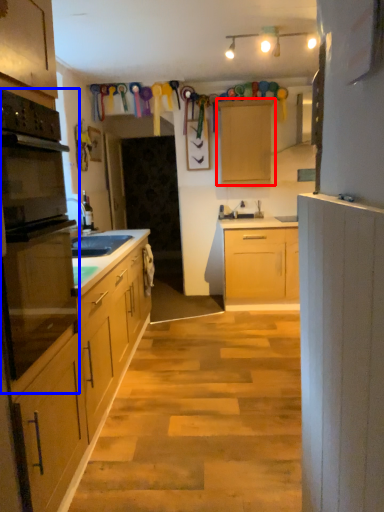
Question: Which object appears farthest to the camera in this image, cabinetry (highlighted by a red box) or oven (highlighted by a blue box)?

Choices:
 (A) cabinetry
 (B) oven

Answer: (A)